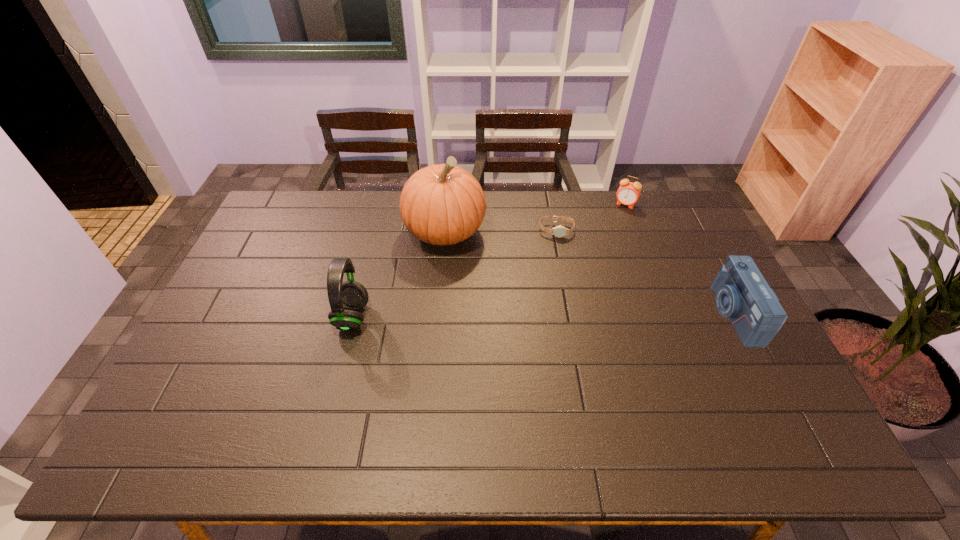
At what (x,y) coordinates should I click in order to perform the action: click on free space located 0.060m on the face of the shortest object. Please return your answer as a coordinate pair (x, y). This screenshot has width=960, height=540. Looking at the image, I should click on pos(557,250).

I want to click on free space located 0.140m on the face of the alarm clock, so coord(611,231).

Where is `free space located 0.230m on the face of the alarm clock`? The width and height of the screenshot is (960, 540). free space located 0.230m on the face of the alarm clock is located at coordinates (603, 246).

This screenshot has height=540, width=960. Identify the location of free point located on the face of the alarm clock. (598, 255).

Locate an element on the screen. Image resolution: width=960 pixels, height=540 pixels. pumpkin that is at the far edge is located at coordinates (443, 204).

At what (x,y) coordinates should I click in order to perform the action: click on watch present at the far edge. Please return your answer as a coordinate pair (x, y). Looking at the image, I should click on (560, 231).

Where is `alarm clock present at the far edge`? This screenshot has height=540, width=960. alarm clock present at the far edge is located at coordinates (628, 193).

Where is `object present at the right edge`? Image resolution: width=960 pixels, height=540 pixels. object present at the right edge is located at coordinates (743, 295).

In the image, there is a desktop. Where is `vacant space at the far edge`? vacant space at the far edge is located at coordinates coord(333,204).

Locate an element on the screen. The height and width of the screenshot is (540, 960). vacant area at the near edge is located at coordinates (635, 406).